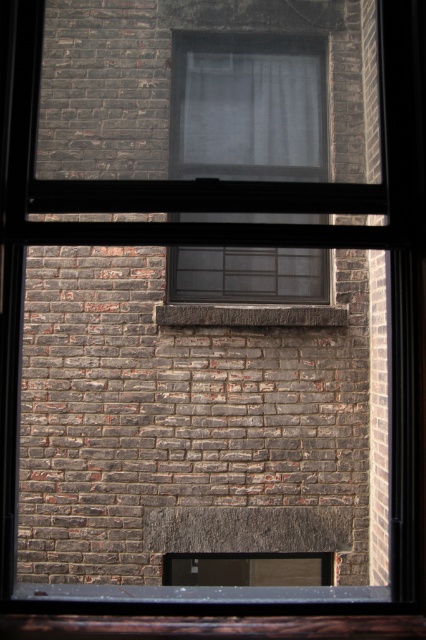
You are an interior designer assessing the space in front of the window. You need to determine if a floor lamp that is 1.5 meters tall can be placed here. Considering the white sheer curtain at center and the brown stone window sill at center, which object will the lamp hit first if placed in front of the window?

The white sheer curtain at center is much taller than the brown stone window sill at center. The lamp will hit the white sheer curtain at center first because it is taller.

You are looking through the clear glass window at center and notice the white sheer curtain at center. Which object is more to the left?

The clear glass window at center is positioned on the left side of white sheer curtain at center, so it is more to the left.

You are an architect designing a new building and need to ensure that the window at the point marked by the coordinates (247, 108) on the brick wall allows maximum natural light. Based on the image, what feature of the window at this point could help achieve this?

The clear glass window at center marked by the coordinates (247, 108) allows maximum natural light due to its clear glass, which does not obstruct light passage.